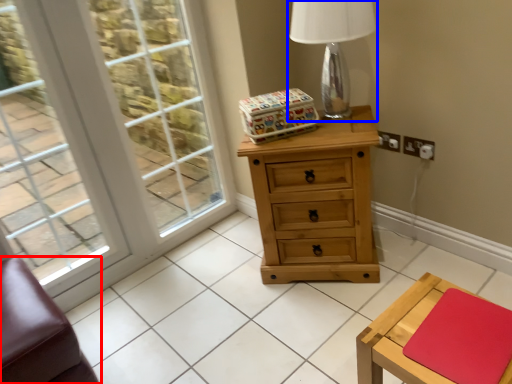
Question: Which of the following is the farthest to the observer, furniture (highlighted by a red box) or table lamp (highlighted by a blue box)?

Choices:
 (A) furniture
 (B) table lamp

Answer: (B)